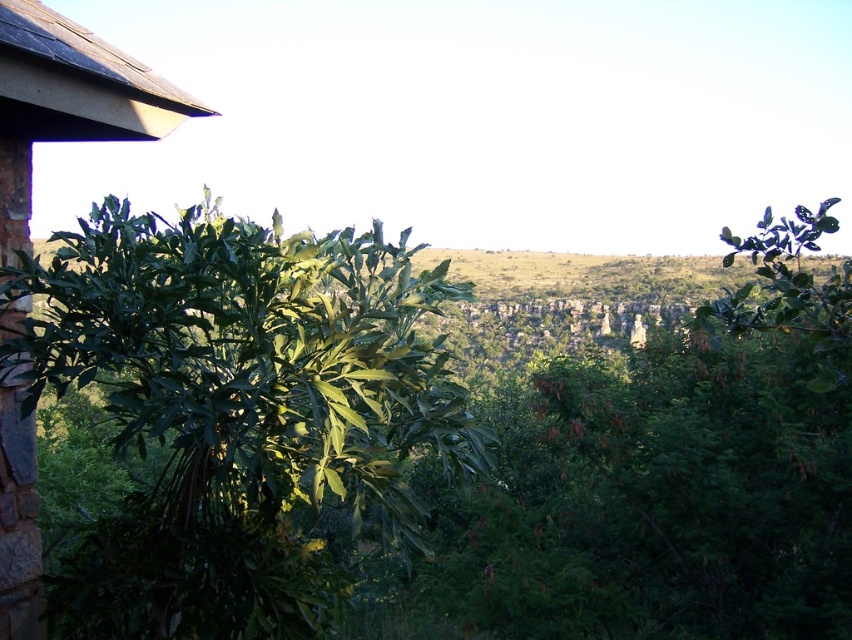
Does green leafy plant at center have a greater height compared to brown stone hut at left?

Yes, green leafy plant at center is taller than brown stone hut at left.

You are a GUI agent. You are given a task and a screenshot of the screen. Output one action in this format:
    pyautogui.click(x=<x>, y=<y>)
    Task: Click on the green leafy plant at center
    The height and width of the screenshot is (640, 852).
    Given the screenshot: What is the action you would take?
    pyautogui.click(x=237, y=412)